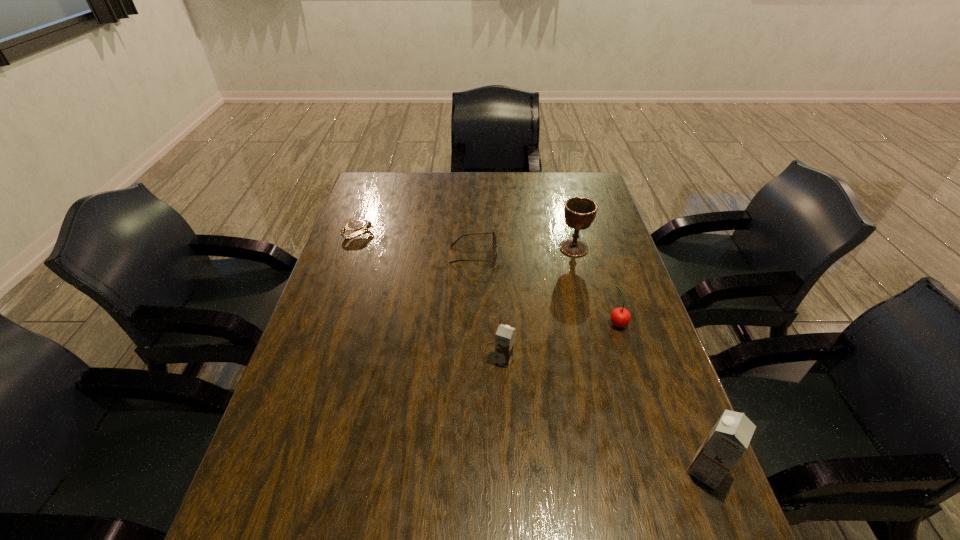
Please point a spot to add another chocolate milk on the left. Please provide its 2D coordinates. Your answer should be formatted as a tuple, i.e. [(x, y)], where the tuple contains the x and y coordinates of a point satisfying the conditions above.

[(366, 285)]